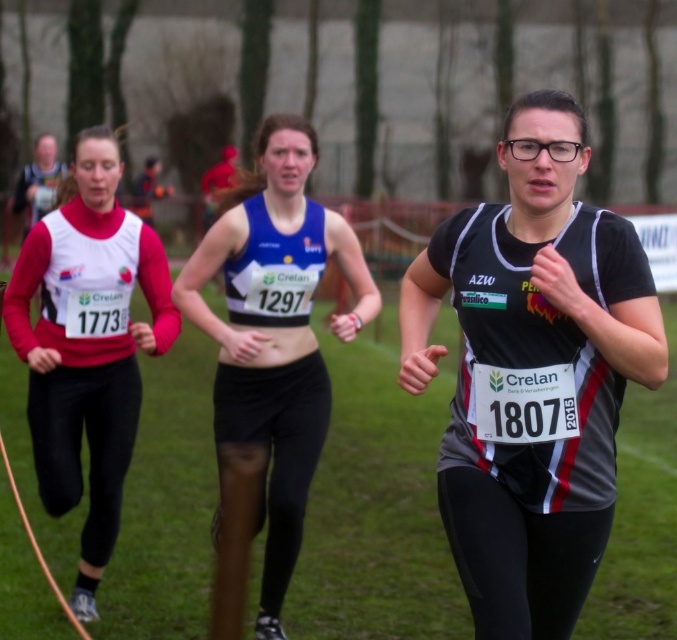
Question: Based on their relative distances, which object is nearer to the matte white vest at left?

Choices:
 (A) black matte running suit at center
 (B) matte black bib at left
 (C) blue fabric top at center

Answer: (C)

Question: Is blue fabric top at center positioned before matte black bib at left?

Choices:
 (A) no
 (B) yes

Answer: (B)

Question: Does black matte running suit at center lie in front of blue fabric top at center?

Choices:
 (A) yes
 (B) no

Answer: (A)

Question: Which of the following is the farthest from the observer?

Choices:
 (A) (554, 616)
 (B) (22, 198)

Answer: (B)

Question: Estimate the real-world distances between objects in this image. Which object is closer to the black matte running suit at center?

Choices:
 (A) matte black bib at left
 (B) blue fabric top at center

Answer: (B)

Question: Does matte white vest at left have a smaller size compared to matte black bib at left?

Choices:
 (A) yes
 (B) no

Answer: (A)